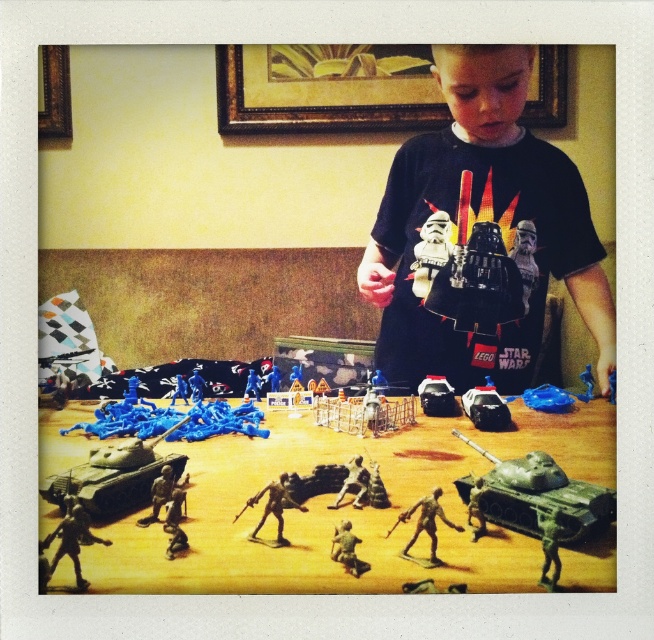
Is black matte t-shirt at center above green matte tank at lower right?

Indeed, black matte t-shirt at center is positioned over green matte tank at lower right.

Which is below, black matte t-shirt at center or green matte tank at lower right?

green matte tank at lower right is lower down.

Identify the location of black matte t-shirt at center. 483,218.

What are the coordinates of `black matte t-shirt at center` in the screenshot? It's located at (483, 218).

Is point (543, 291) farther from viewer compared to point (351, 484)?

Yes, point (543, 291) is farther from viewer.

Does black matte t-shirt at center appear over green plastic tank at center?

Indeed, black matte t-shirt at center is positioned over green plastic tank at center.

At what (x,y) coordinates should I click in order to perform the action: click on black matte t-shirt at center. Please return your answer as a coordinate pair (x, y). This screenshot has height=640, width=654. Looking at the image, I should click on (483, 218).

Is black matte t-shirt at center smaller than black plastic tank at center?

No.

Does black matte t-shirt at center appear on the right side of black plastic tank at center?

Correct, you'll find black matte t-shirt at center to the right of black plastic tank at center.

Who is more distant from viewer, (x=610, y=344) or (x=455, y=406)?

Point (x=610, y=344)

At what (x,y) coordinates should I click in order to perform the action: click on black matte t-shirt at center. Please return your answer as a coordinate pair (x, y). The image size is (654, 640). Looking at the image, I should click on (483, 218).